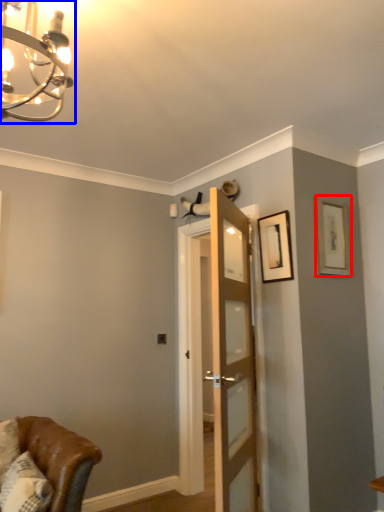
Question: Among these objects, which one is nearest to the camera, picture frame (highlighted by a red box) or light fixture (highlighted by a blue box)?

Choices:
 (A) picture frame
 (B) light fixture

Answer: (B)